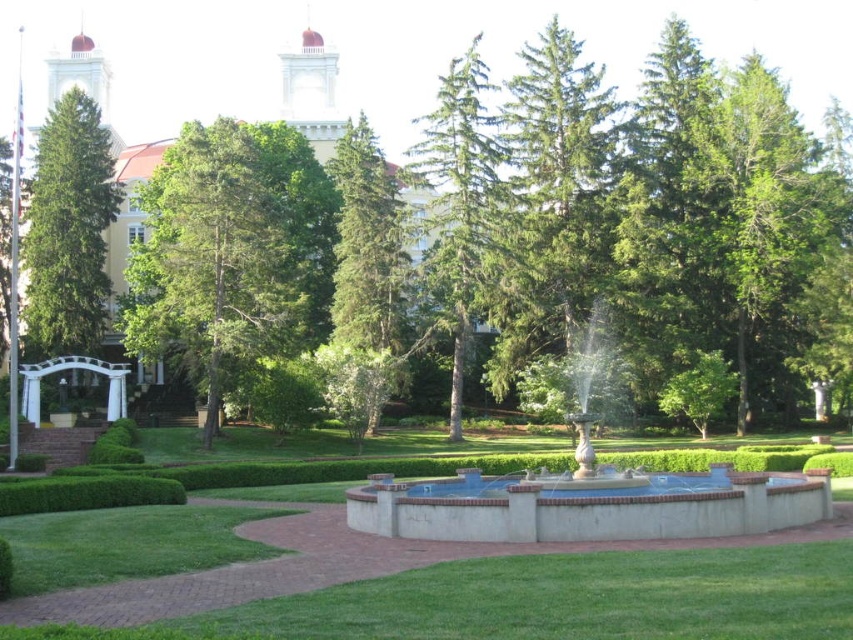
Question: Which of the following is the farthest from the observer?

Choices:
 (A) (573, 212)
 (B) (90, 168)
 (C) (123, 476)

Answer: (B)

Question: Which object is closer to the camera taking this photo?

Choices:
 (A) green fir at center
 (B) green textured pine tree at left
 (C) green matte tree at center
 (D) green needle-like tree at center

Answer: (B)

Question: Can you confirm if green matte tree at center is positioned to the right of green fir tree at center?

Choices:
 (A) yes
 (B) no

Answer: (B)

Question: Among these objects, which one is farthest from the camera?

Choices:
 (A) green smooth grass at lower center
 (B) blue concrete fountain at center
 (C) green fir tree at center

Answer: (C)

Question: Can you confirm if green textured pine tree at left is smaller than green fir at center?

Choices:
 (A) no
 (B) yes

Answer: (A)

Question: In this image, where is green fir tree at center located relative to green textured pine tree at left?

Choices:
 (A) left
 (B) right

Answer: (B)